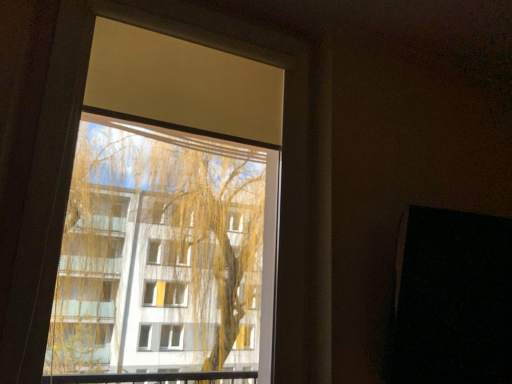
Question: Can you confirm if transparent glass window at upper center is bigger than black matte screen door at right?

Choices:
 (A) no
 (B) yes

Answer: (B)

Question: Considering the relative sizes of transparent glass window at upper center and black matte screen door at right in the image provided, is transparent glass window at upper center shorter than black matte screen door at right?

Choices:
 (A) yes
 (B) no

Answer: (B)

Question: Considering the relative sizes of transparent glass window at upper center and black matte screen door at right in the image provided, is transparent glass window at upper center thinner than black matte screen door at right?

Choices:
 (A) no
 (B) yes

Answer: (B)

Question: Does transparent glass window at upper center appear on the left side of black matte screen door at right?

Choices:
 (A) no
 (B) yes

Answer: (B)

Question: From the image's perspective, is transparent glass window at upper center under black matte screen door at right?

Choices:
 (A) no
 (B) yes

Answer: (A)

Question: From a real-world perspective, is transparent glass window at upper center below black matte screen door at right?

Choices:
 (A) yes
 (B) no

Answer: (B)

Question: Is black matte screen door at right aimed at transparent glass window at upper center?

Choices:
 (A) yes
 (B) no

Answer: (B)

Question: Is black matte screen door at right smaller than transparent glass window at upper center?

Choices:
 (A) no
 (B) yes

Answer: (B)

Question: Can you see black matte screen door at right touching transparent glass window at upper center?

Choices:
 (A) no
 (B) yes

Answer: (A)

Question: Considering the relative sizes of black matte screen door at right and transparent glass window at upper center in the image provided, is black matte screen door at right shorter than transparent glass window at upper center?

Choices:
 (A) yes
 (B) no

Answer: (A)

Question: Does black matte screen door at right come behind transparent glass window at upper center?

Choices:
 (A) no
 (B) yes

Answer: (B)

Question: Is black matte screen door at right at the right side of transparent glass window at upper center?

Choices:
 (A) yes
 (B) no

Answer: (A)

Question: Is point (460, 271) closer or farther from the camera than point (6, 364)?

Choices:
 (A) closer
 (B) farther

Answer: (B)